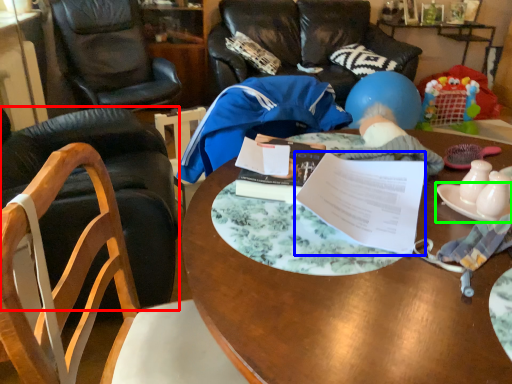
Question: Based on their relative distances, which object is farther from chair (highlighted by a red box)? Choose from document (highlighted by a blue box) and plate (highlighted by a green box).

Choices:
 (A) document
 (B) plate

Answer: (B)